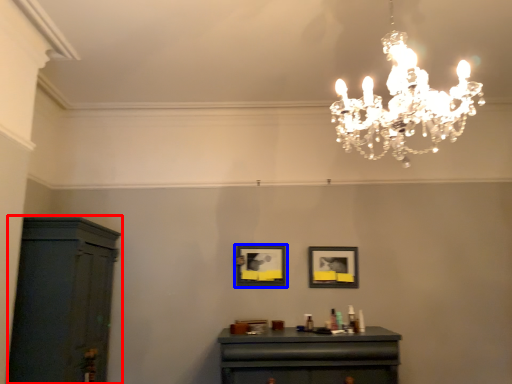
Question: Among these objects, which one is farthest to the camera, cabinetry (highlighted by a red box) or picture frame (highlighted by a blue box)?

Choices:
 (A) cabinetry
 (B) picture frame

Answer: (B)